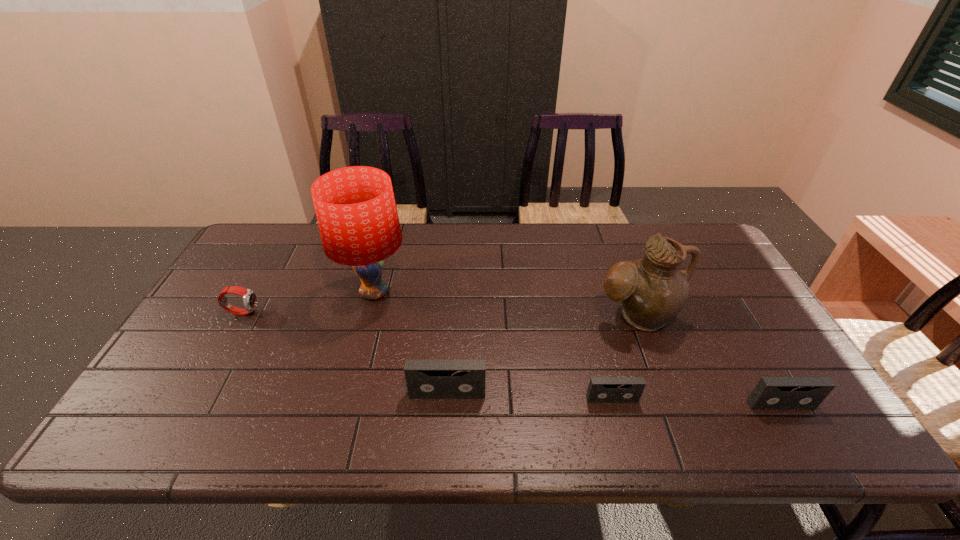
I want to click on free space located on the front-facing side of the lampshade, so click(473, 293).

What are the coordinates of `vacant space located at the spout of the second tallest object` in the screenshot? It's located at (664, 388).

The image size is (960, 540). In order to click on free spot located 0.150m on the face of the watch in this screenshot , I will do `click(311, 312)`.

At what (x,y) coordinates should I click in order to perform the action: click on object that is at the left edge. Please return your answer as a coordinate pair (x, y). The width and height of the screenshot is (960, 540). Looking at the image, I should click on (249, 297).

Where is `object that is positioned at the right edge`? object that is positioned at the right edge is located at coordinates (771, 393).

Where is `object present at the near right corner`? Image resolution: width=960 pixels, height=540 pixels. object present at the near right corner is located at coordinates (771, 393).

In the image, there is a desktop. At what (x,y) coordinates should I click in order to perform the action: click on vacant area at the far edge. Please return your answer as a coordinate pair (x, y). Image resolution: width=960 pixels, height=540 pixels. Looking at the image, I should click on (584, 262).

The width and height of the screenshot is (960, 540). I want to click on free space at the near edge of the desktop, so click(704, 409).

At what (x,y) coordinates should I click in order to perform the action: click on free space at the right edge of the desktop. Please return your answer as a coordinate pair (x, y). Looking at the image, I should click on (766, 359).

The height and width of the screenshot is (540, 960). I want to click on vacant area at the far left corner of the desktop, so click(252, 239).